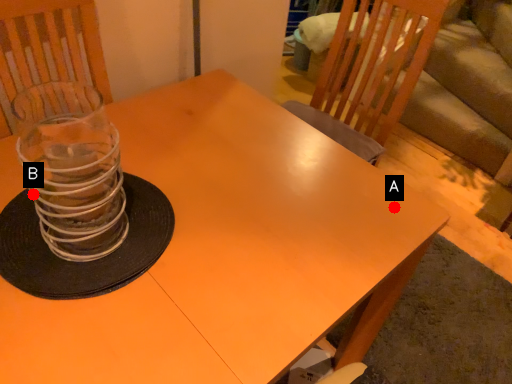
Question: Two points are circled on the image, labeled by A and B beside each circle. Among these points, which one is nearest to the camera?

Choices:
 (A) A is closer
 (B) B is closer

Answer: (B)